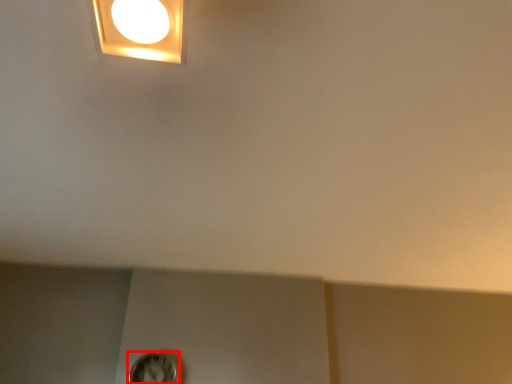
Question: Considering the relative positions of clock (annotated by the red box) and lamp in the image provided, where is clock (annotated by the red box) located with respect to the staircase?

Choices:
 (A) right
 (B) left

Answer: (B)